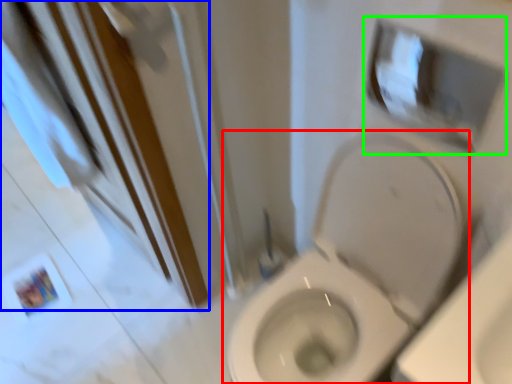
Question: Estimate the real-world distances between objects in this image. Which object is closer to toilet (highlighted by a red box), screen door (highlighted by a blue box) or medicine cabinet (highlighted by a green box)?

Choices:
 (A) screen door
 (B) medicine cabinet

Answer: (B)